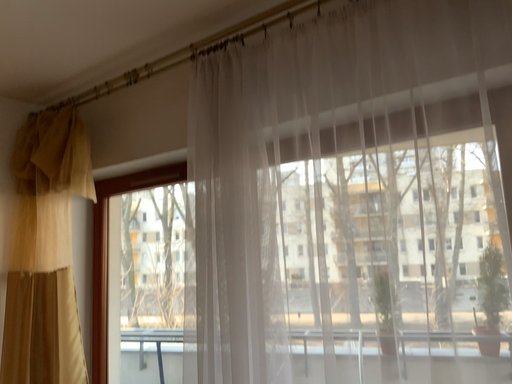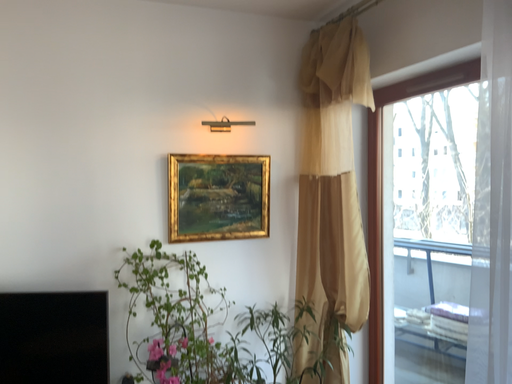
Question: Which way did the camera rotate in the video?

Choices:
 (A) rotated left
 (B) rotated right

Answer: (A)